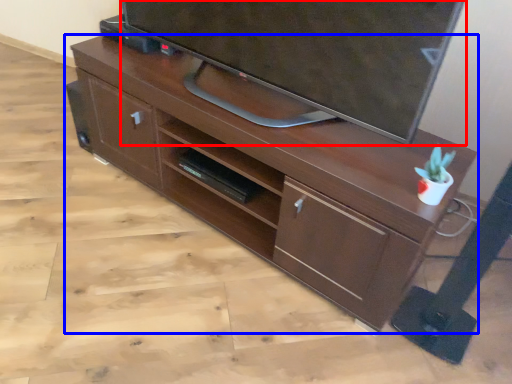
Question: Which object is closer to the camera taking this photo, television (highlighted by a red box) or desk (highlighted by a blue box)?

Choices:
 (A) television
 (B) desk

Answer: (A)